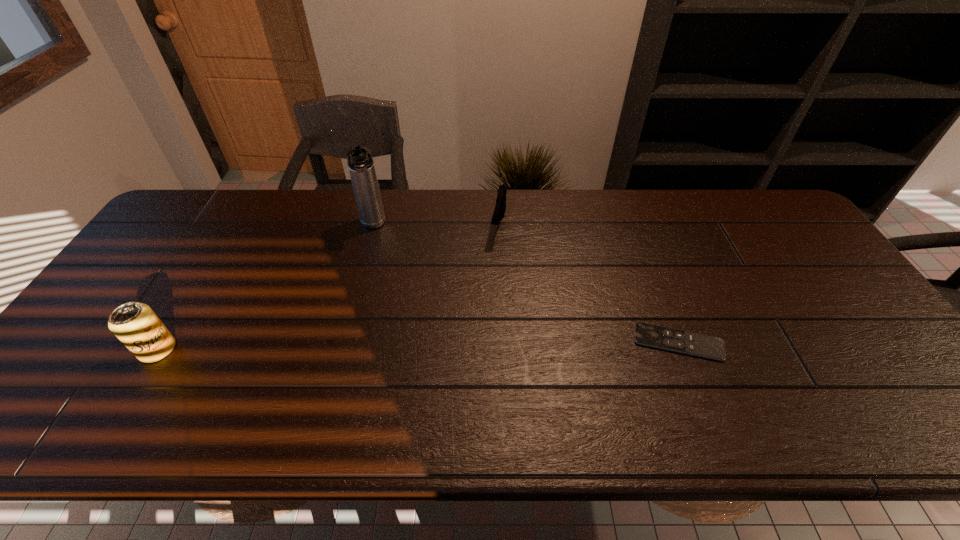
Identify the location of beer can. (135, 324).

I want to click on the third shortest object, so tap(135, 324).

Where is `the rightmost object`? The image size is (960, 540). the rightmost object is located at coordinates (710, 347).

Image resolution: width=960 pixels, height=540 pixels. In order to click on remote control in this screenshot , I will do `click(710, 347)`.

Find the location of a particular element. Image resolution: width=960 pixels, height=540 pixels. the second shortest object is located at coordinates (500, 207).

The image size is (960, 540). I want to click on the third object from left to right, so click(x=500, y=207).

Locate an element on the screen. The height and width of the screenshot is (540, 960). thermos bottle is located at coordinates (361, 166).

Where is `the tallest object`? The height and width of the screenshot is (540, 960). the tallest object is located at coordinates click(x=361, y=166).

The height and width of the screenshot is (540, 960). I want to click on vacant area situated 0.170m on the right of the beer can, so click(244, 349).

The height and width of the screenshot is (540, 960). Find the location of `vacant area situated 0.200m on the right of the shortest object`. vacant area situated 0.200m on the right of the shortest object is located at coordinates (804, 342).